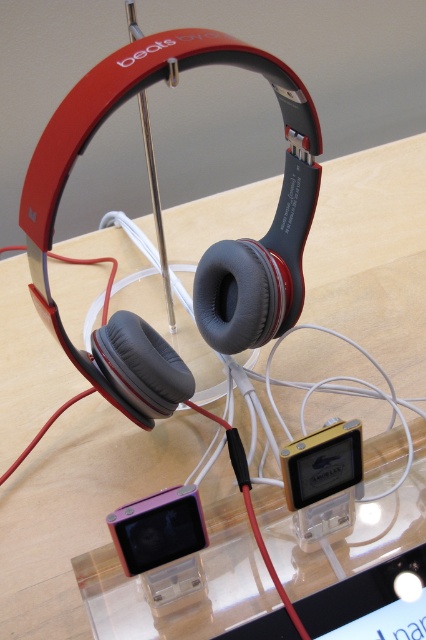
You are a customer at an electronics store and want to know the distance between the pink glossy ipod at lower center and the metallic pink ipod at center. Can you tell me how far apart they are?

The pink glossy ipod at lower center is 4.77 inches from metallic pink ipod at center.

You are a customer at an electronics store and want to pick up the pink glossy ipod at lower center. Can you grab it without moving the metallic pink ipod at center?

The pink glossy ipod at lower center is in front of the metallic pink ipod at center, so you can grab it without moving the metallic pink ipod at center.

You are a photographer taking a closeup shot of the headphones and iPods. You want to focus on the point that is closer to the camera. Which point should you choose between point (180,513) and point (307,480)?

Point (180,513) is closer to the camera than point (307,480), so you should choose point (180,513) to focus on.